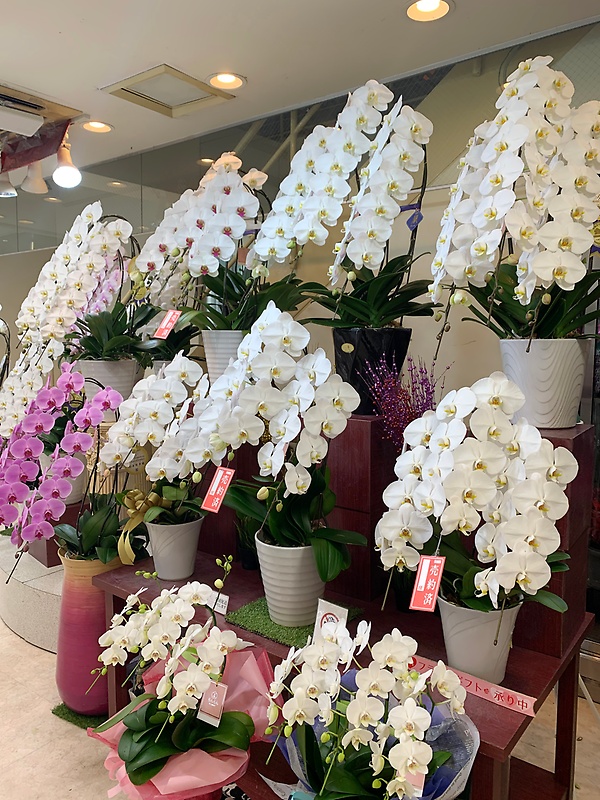
In order to click on pots in this screenshot , I will do `click(459, 625)`, `click(267, 578)`, `click(176, 541)`, `click(85, 566)`, `click(536, 374)`, `click(387, 348)`, `click(226, 342)`, `click(107, 370)`.